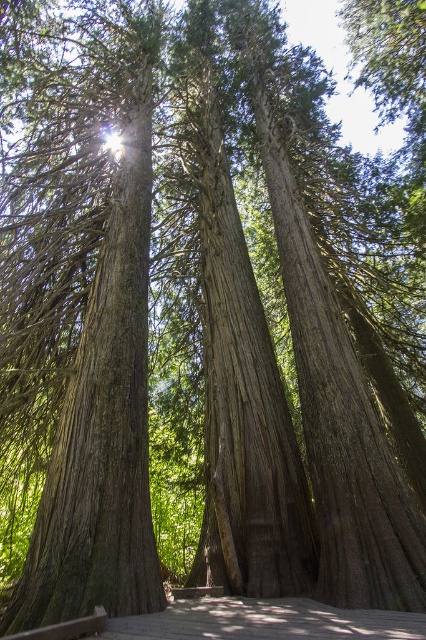
You are standing on the wooden walkway at center and looking up at the smooth brown tree trunk at center. Which object is closer to your eyes?

The smooth brown tree trunk at center is closer to your eyes than the wooden walkway at center because it is positioned in front of the walkway.

Based on the photo, you are standing on the wooden walkway at center. Looking up, you notice the towering redwood trees around you. Based on your position, which direction would the sunlight be coming from if the dappled light on the walkway is brightest at point 0.972, 0.620?

The sunlight is coming from the direction opposite to the point where the light is brightest on the wooden walkway at center. Since the brightest spot is at coordinates (264, 621), the light source is likely positioned in the opposite quadrant relative to the walkway.

You are a maintenance worker who needs to inspect the wooden walkway at center and the brown wooden park bench at center. The safety regulations state that the distance between these two structures must be at least 1.5 meters to allow safe passage. Based on the scene, does the current distance meet the requirement?

The wooden walkway at center is 1.48 meters away from the brown wooden park bench at center. Since 1.48 meters is less than the required 1.5 meters, the current distance does not meet the safety requirement.